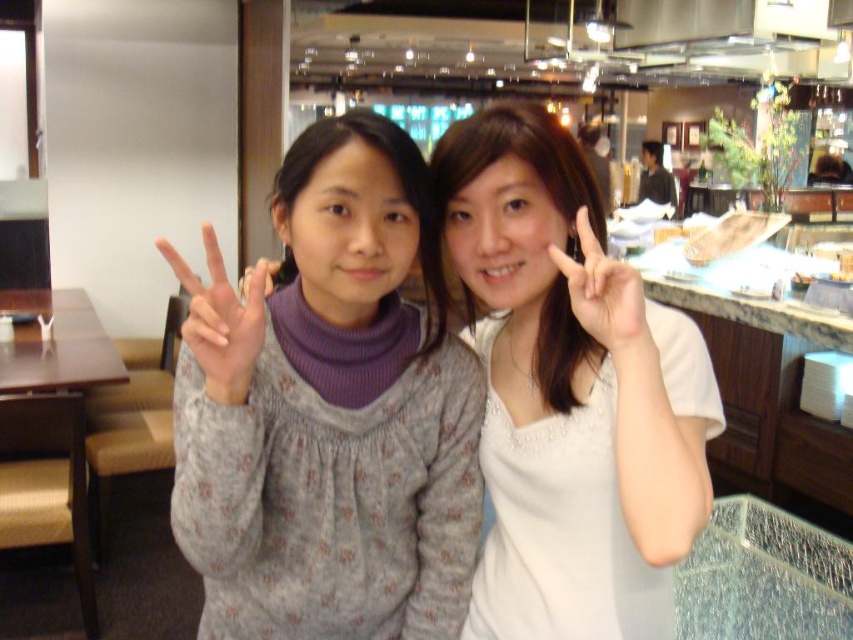
You are a photographer trying to position two subjects in a photo. The gray textured sweater at center belongs to the person on the left, and the white matte hand at center is the right hand of the person on the right. Based on the scene, which object is closer to the left side of the frame?

The gray textured sweater at center is closer to the left side of the frame because it is positioned to the left of the white matte hand at center.

You are a photographer adjusting the lighting in the scene. You notice the gray textured sweater at center and the white matte hand at center. Which object should you focus on if you want to highlight the larger one?

The gray textured sweater at center has a larger size compared to the white matte hand at center, so you should focus on the gray textured sweater at center to highlight the larger one.